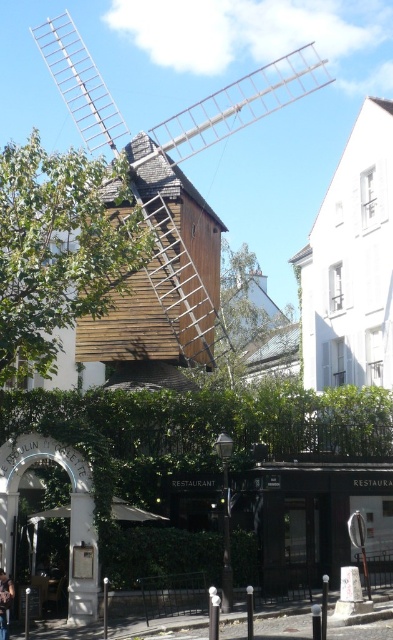
Question: Which object is closer to the camera taking this photo?

Choices:
 (A) dark brown leather jacket at lower left
 (B) wooden windmill at center

Answer: (A)

Question: Can you confirm if wooden windmill at center is positioned above dark brown leather jacket at lower left?

Choices:
 (A) yes
 (B) no

Answer: (A)

Question: Is wooden windmill at center in front of dark brown leather jacket at lower left?

Choices:
 (A) yes
 (B) no

Answer: (B)

Question: Is wooden windmill at center to the right of dark brown leather jacket at lower left from the viewer's perspective?

Choices:
 (A) no
 (B) yes

Answer: (B)